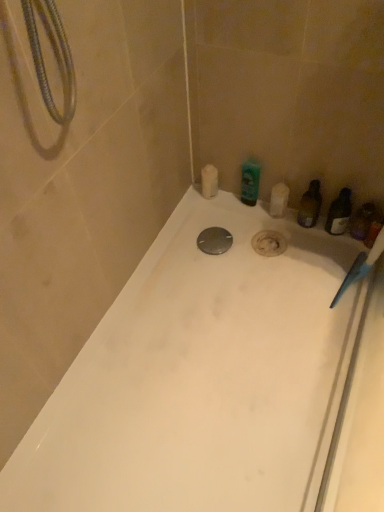
Identify the location of free point to the left of translucent plastic bottle at right, positioned as the 4th toiletry in left-to-right order. Image resolution: width=384 pixels, height=512 pixels. (299, 251).